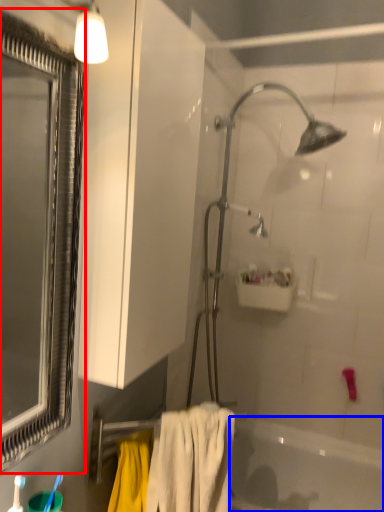
Question: Which object appears farthest to the camera in this image, window (highlighted by a red box) or bathtub (highlighted by a blue box)?

Choices:
 (A) window
 (B) bathtub

Answer: (B)